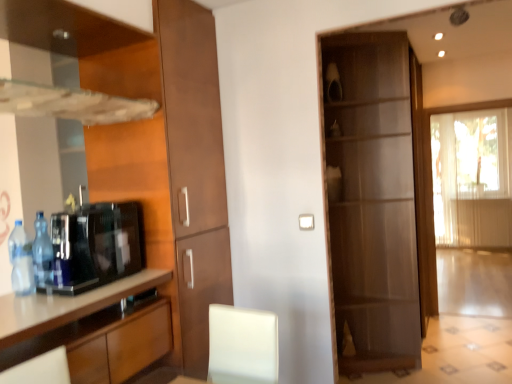
This screenshot has height=384, width=512. Identify the location of vacant area that lies to the right of blue plastic bottle at left, which is the first bottle in front-to-back order. [x=57, y=294].